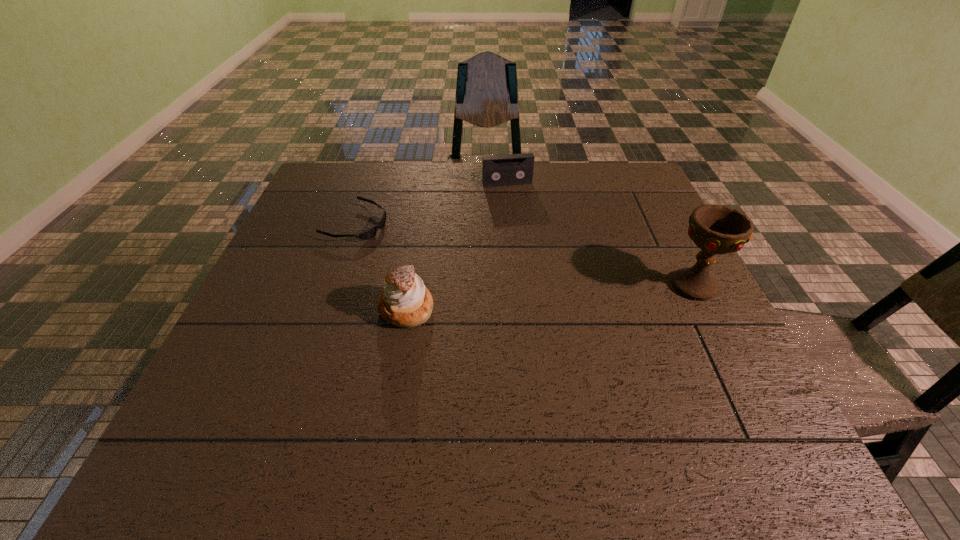
Where is `free space between the shortest object and the third shortest object`? The width and height of the screenshot is (960, 540). free space between the shortest object and the third shortest object is located at coordinates (x=381, y=266).

The image size is (960, 540). I want to click on free space between the shortest object and the tallest object, so click(x=524, y=254).

You are a GUI agent. You are given a task and a screenshot of the screen. Output one action in this format:
    pyautogui.click(x=<x>, y=<y>)
    Task: Click on the free space between the farthest object and the tallest object
    
    Given the screenshot: What is the action you would take?
    (600, 234)

The height and width of the screenshot is (540, 960). In order to click on free space between the second shortest object and the tallest object in this screenshot , I will do `click(600, 234)`.

At what (x,y) coordinates should I click in order to perform the action: click on empty space that is in between the leftmost object and the pastry. Please return your answer as a coordinate pair (x, y). The width and height of the screenshot is (960, 540). Looking at the image, I should click on (381, 266).

Locate which object is the third closest to the sunglasses. Please provide its 2D coordinates. Your answer should be formatted as a tuple, i.e. [(x, y)], where the tuple contains the x and y coordinates of a point satisfying the conditions above.

[(716, 229)]

Identify which object is located as the third nearest to the tallest object. Please provide its 2D coordinates. Your answer should be formatted as a tuple, i.e. [(x, y)], where the tuple contains the x and y coordinates of a point satisfying the conditions above.

[(371, 232)]

You are a GUI agent. You are given a task and a screenshot of the screen. Output one action in this format:
    pyautogui.click(x=<x>, y=<y>)
    Task: Click on the vacant space that satisfies the following two spatial constraints: 1. on the back side of the third tallest object; 2. on the right side of the sunglasses
    
    Given the screenshot: What is the action you would take?
    pyautogui.click(x=370, y=184)

At what (x,y) coordinates should I click in order to perform the action: click on vacant position in the image that satisfies the following two spatial constraints: 1. on the back side of the farthest object; 2. on the left side of the pastry. Please return your answer as a coordinate pair (x, y). The image size is (960, 540). Looking at the image, I should click on (427, 184).

Locate an element on the screen. blank area in the image that satisfies the following two spatial constraints: 1. on the back side of the third shortest object; 2. on the right side of the tallest object is located at coordinates (410, 286).